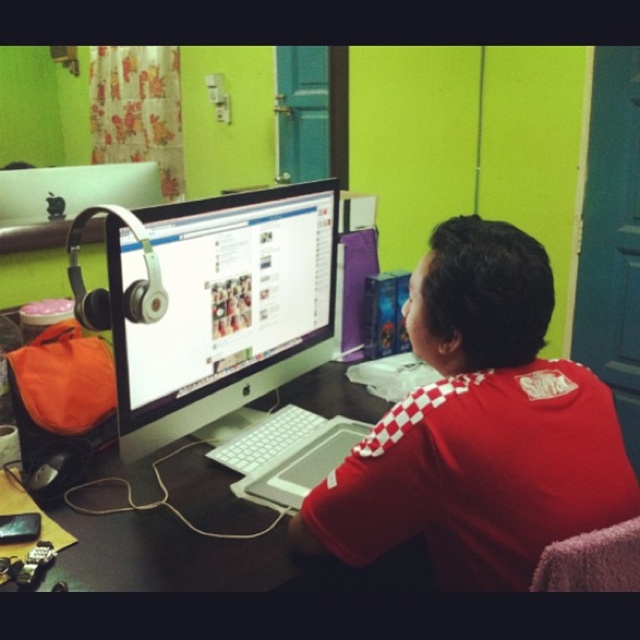
From the picture: Based on the scene described, where is the white glossy monitor at center positioned relative to the black glossy table at center?

The white glossy monitor at center is positioned to the left of the black glossy table at center.

You are organizing a desk and need to place a new keyboard that requires 30 cm of space. The white glossy monitor at center and the black glossy table at center are in the way. Which object should you move to make space?

The white glossy monitor at center is above the black glossy table at center, so you should move the white glossy monitor at center to make space for the keyboard since it is positioned on top of the table.

You are a photographer trying to capture a closeup of the red checkered shirt at center and the black glossy table at center. Since you want to focus on both objects equally, which one should you adjust your camera angle to prioritize in terms of height?

The red checkered shirt at center has a greater height compared to the black glossy table at center, so you should lower your camera angle to prioritize focusing on the red checkered shirt at center to ensure both are in focus.